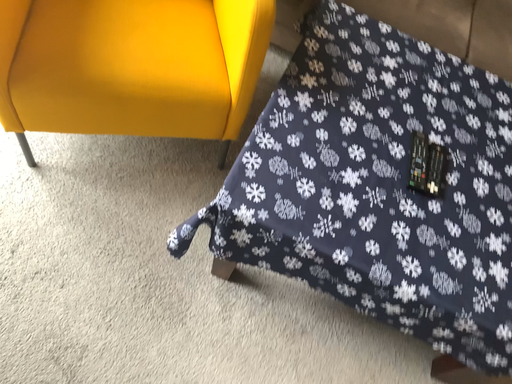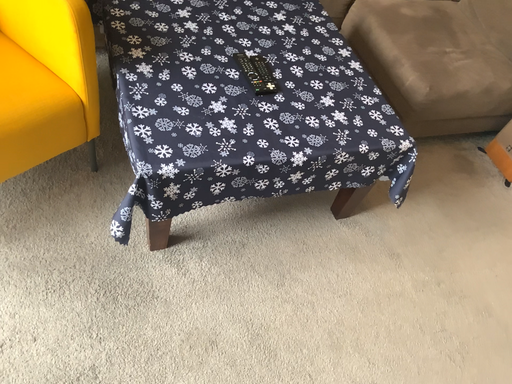
Question: Which way did the camera rotate in the video?

Choices:
 (A) rotated left
 (B) rotated right

Answer: (B)